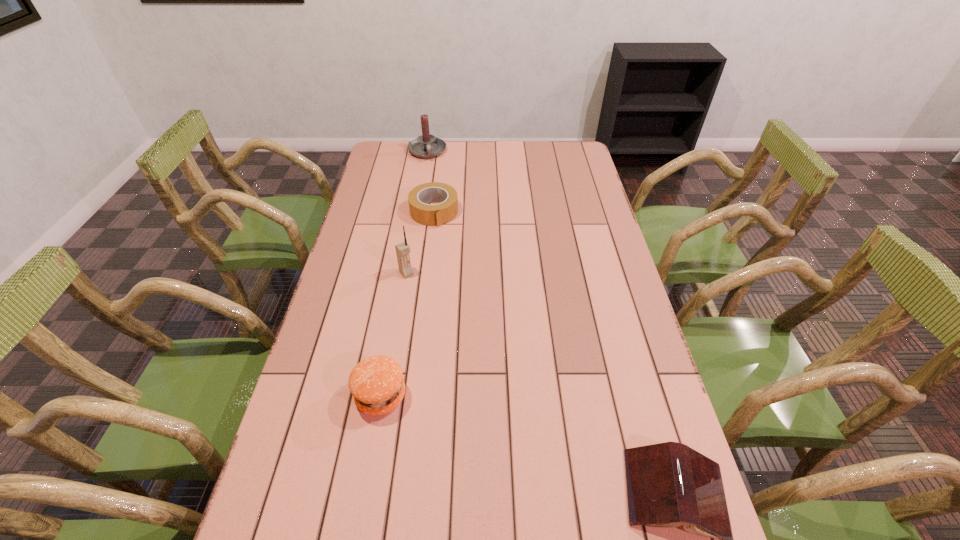
You are a GUI agent. You are given a task and a screenshot of the screen. Output one action in this format:
    pyautogui.click(x=<x>, y=<y>)
    Task: Click on the free region at the near edge of the desktop
    This screenshot has width=960, height=540.
    Given the screenshot: What is the action you would take?
    pyautogui.click(x=556, y=519)

Where is `vacant region at the left edge of the desktop`? The width and height of the screenshot is (960, 540). vacant region at the left edge of the desktop is located at coordinates (391, 197).

Identify the location of vacant space at the right edge of the desktop. This screenshot has height=540, width=960. (596, 247).

Identify the location of free space at the far left corner of the desktop. The width and height of the screenshot is (960, 540). (391, 165).

Find the location of `blank space at the near left corner of the desktop`. blank space at the near left corner of the desktop is located at coordinates (277, 510).

Where is `free spot between the duct tape and the candle`? Image resolution: width=960 pixels, height=540 pixels. free spot between the duct tape and the candle is located at coordinates [x=431, y=182].

The width and height of the screenshot is (960, 540). What are the coordinates of `vacant area between the second farthest object and the fourth farthest object` in the screenshot? It's located at (407, 304).

Identify the location of empty space that is in between the patty and the second farthest object. The image size is (960, 540). (407, 304).

Where is `object that ranks as the second closest to the patty`? Image resolution: width=960 pixels, height=540 pixels. object that ranks as the second closest to the patty is located at coordinates (669, 484).

Choose which object is the third nearest neighbor to the third farthest object. Please provide its 2D coordinates. Your answer should be formatted as a tuple, i.e. [(x, y)], where the tuple contains the x and y coordinates of a point satisfying the conditions above.

[(425, 146)]